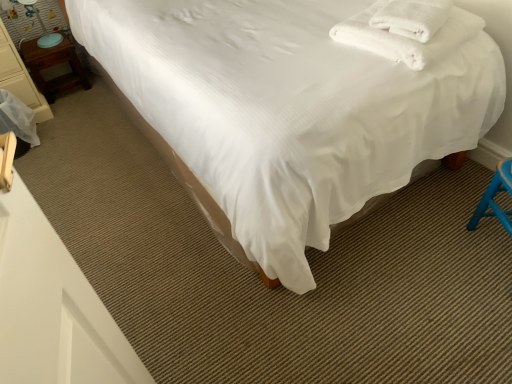
Where is `free space between wooden nightstand at left and wooden nightstand at left`? free space between wooden nightstand at left and wooden nightstand at left is located at coordinates (69, 101).